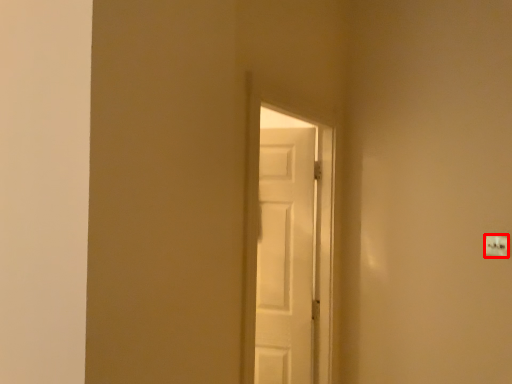
Question: From the image's perspective, where is light switch (annotated by the red box) located relative to door?

Choices:
 (A) below
 (B) above

Answer: (B)